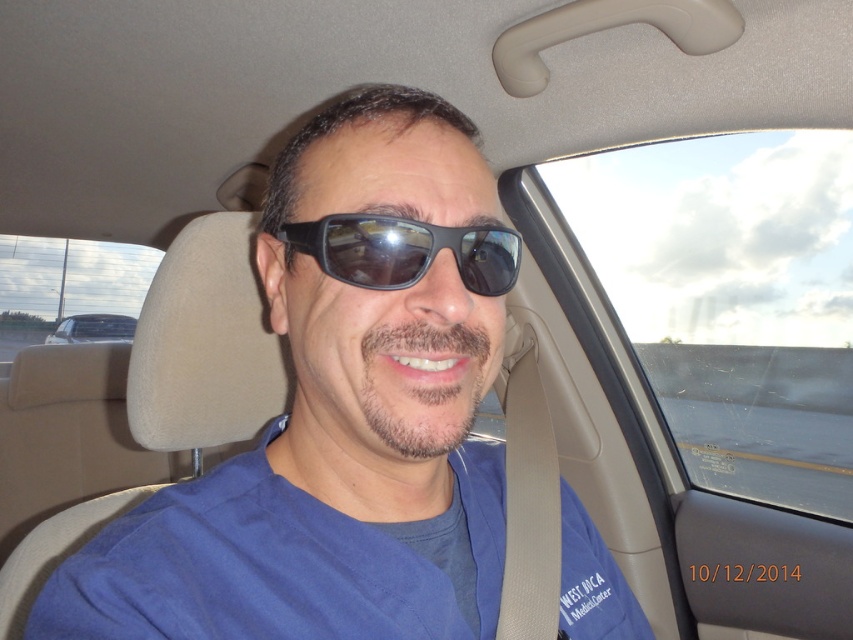
Question: Is matte black sunglasses at center bigger than metallic silver car at left?

Choices:
 (A) yes
 (B) no

Answer: (B)

Question: Which is nearer to the metallic silver car at left?

Choices:
 (A) blue fabric shirt at center
 (B) black matte sunglasses at center

Answer: (A)

Question: Which point appears farthest from the camera in this image?

Choices:
 (A) (514, 241)
 (B) (343, 604)
 (C) (180, 621)

Answer: (A)

Question: Where is matte black sunglasses at center located in relation to blue fabric shirt at center in the image?

Choices:
 (A) below
 (B) above

Answer: (B)

Question: Which object appears farthest from the camera in this image?

Choices:
 (A) metallic silver car at left
 (B) black matte sunglasses at center
 (C) matte black sunglasses at center

Answer: (A)

Question: Does matte black sunglasses at center appear on the right side of metallic silver car at left?

Choices:
 (A) no
 (B) yes

Answer: (B)